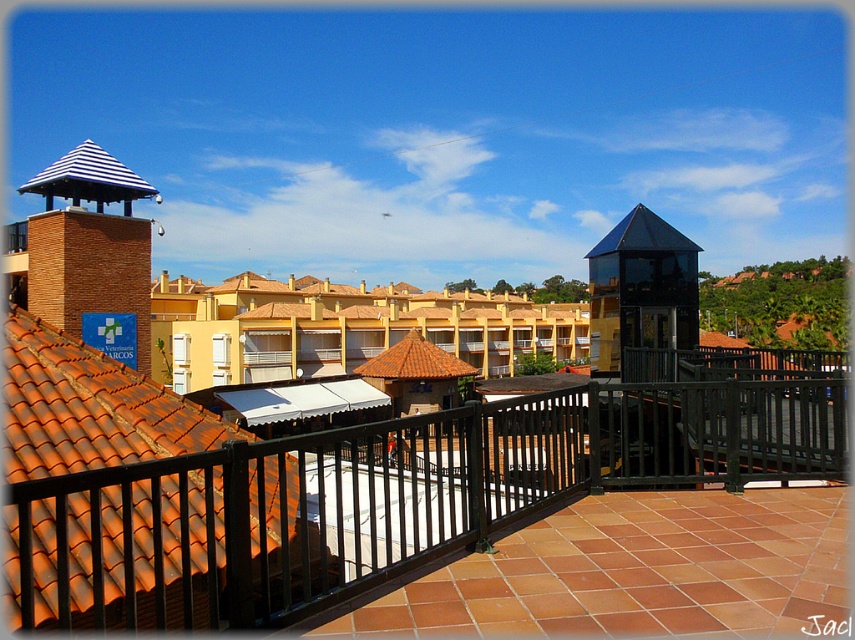
Which is above, brick bell tower at left or shiny black roof at upper right?

shiny black roof at upper right

Is brick bell tower at left shorter than shiny black roof at upper right?

No, brick bell tower at left is not shorter than shiny black roof at upper right.

The image size is (855, 640). What are the coordinates of `brick bell tower at left` in the screenshot? It's located at pos(87,253).

This screenshot has height=640, width=855. I want to click on brick bell tower at left, so click(x=87, y=253).

Is blue and white striped roof at upper left to the left of brown tile roof at center from the viewer's perspective?

Yes, blue and white striped roof at upper left is to the left of brown tile roof at center.

Is blue and white striped roof at upper left wider than brown tile roof at center?

Yes.

Where is `blue and white striped roof at upper left`? blue and white striped roof at upper left is located at coordinates (87, 177).

The image size is (855, 640). Identify the location of blue and white striped roof at upper left. (87, 177).

Between black metal railing at lower left and blue and white striped roof at upper left, which one has more height?

Standing taller between the two is blue and white striped roof at upper left.

Is point (434, 484) positioned behind point (115, 172)?

No, (434, 484) is closer to viewer.

The image size is (855, 640). What do you see at coordinates (399, 490) in the screenshot? I see `black metal railing at lower left` at bounding box center [399, 490].

What are the coordinates of `black metal railing at lower left` in the screenshot? It's located at (399, 490).